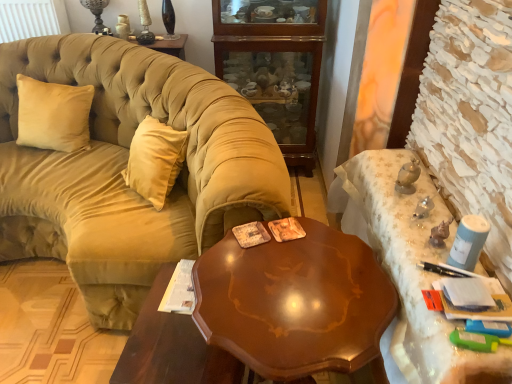
Identify the location of free space above shiny brown wood table at center, which appears as the 2th desk when viewed from the right (from a real-world perspective). (264, 285).